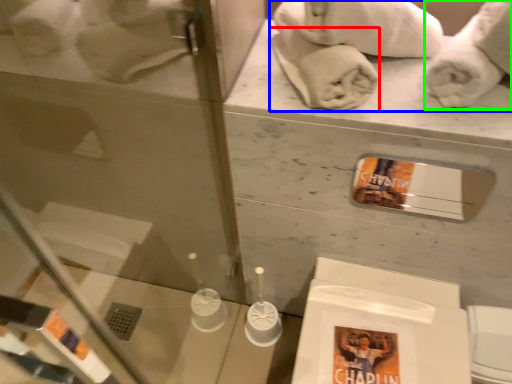
Question: Based on their relative distances, which object is nearer to bath towel (highlighted by a red box)? Choose from bath towel (highlighted by a blue box) and bath towel (highlighted by a green box).

Choices:
 (A) bath towel
 (B) bath towel

Answer: (A)